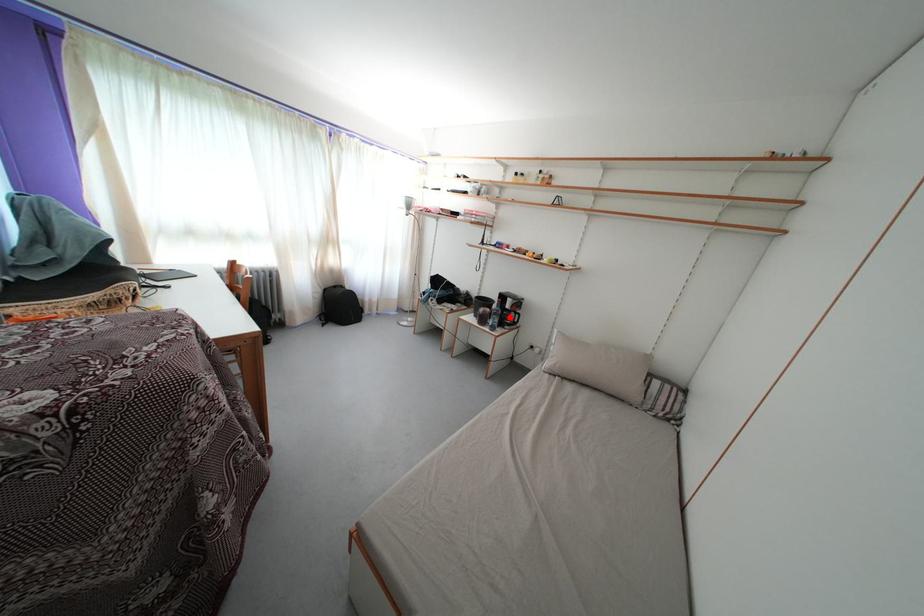
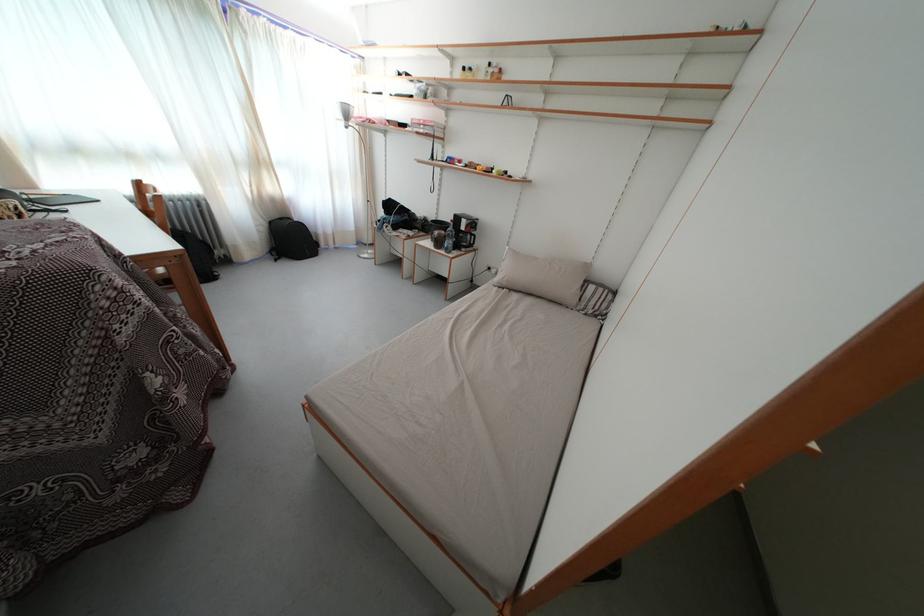
Find the pixel in the second image that matches the highlighted location in the first image.

(467, 240)